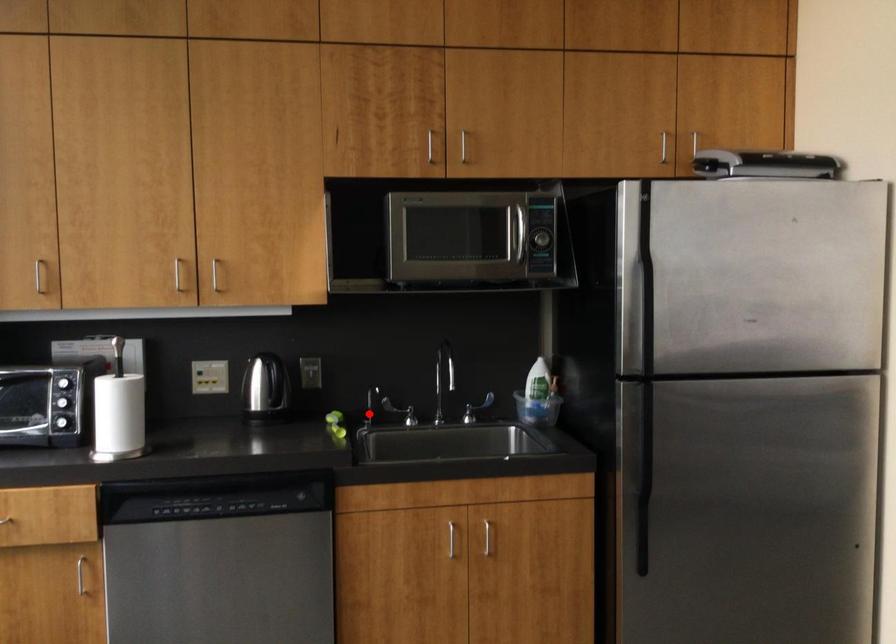
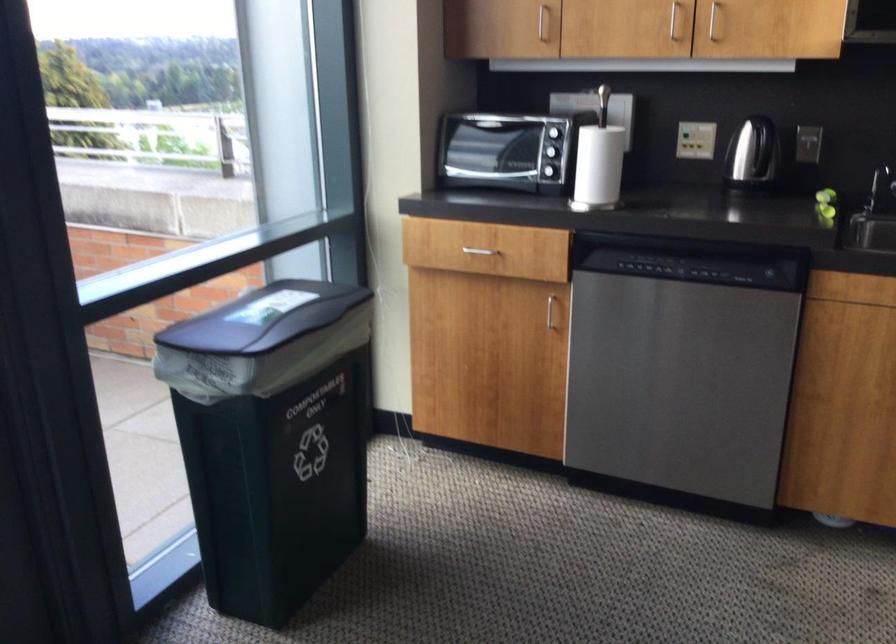
The point at the highlighted location is marked in the first image. Where is the corresponding point in the second image?

(879, 187)